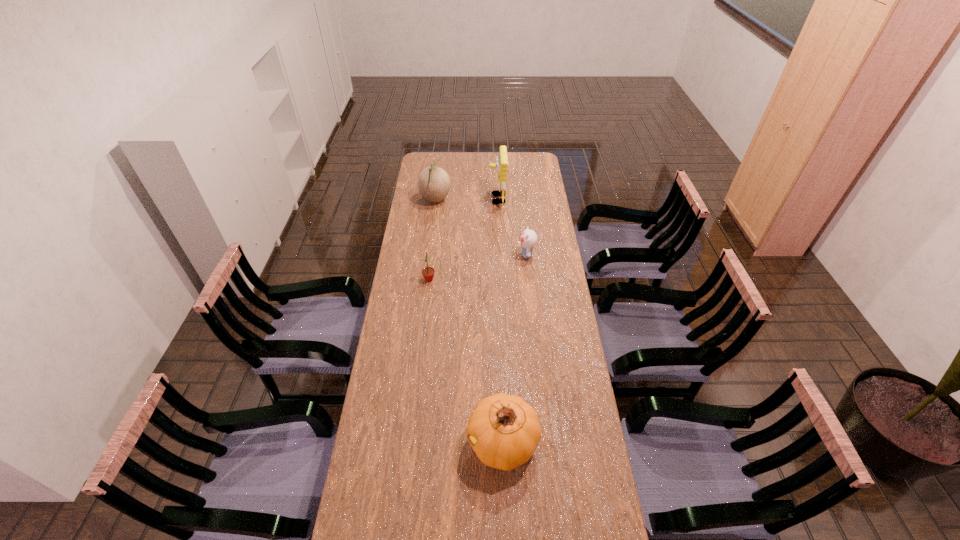
The width and height of the screenshot is (960, 540). What are the coordinates of `sponge` in the screenshot? It's located at (501, 165).

Where is `cantaloup`? The width and height of the screenshot is (960, 540). cantaloup is located at coordinates (433, 183).

You are a GUI agent. You are given a task and a screenshot of the screen. Output one action in this format:
    pyautogui.click(x=<x>, y=<y>)
    Task: Click on the pumpkin
    
    Given the screenshot: What is the action you would take?
    pyautogui.click(x=503, y=430)

At what (x,y) coordinates should I click in order to perform the action: click on sunflower. Please return your answer as a coordinate pair (x, y). The image size is (960, 540). Looking at the image, I should click on (428, 272).

Where is `the second nearest object`? The height and width of the screenshot is (540, 960). the second nearest object is located at coordinates (428, 272).

Where is `the shortest object`? the shortest object is located at coordinates (528, 238).

Identify the location of kitten. (528, 238).

Identify the location of vacant space located on the face of the sponge. (453, 199).

This screenshot has width=960, height=540. In order to click on blank space located 0.170m on the face of the sponge in this screenshot , I will do click(x=457, y=199).

Image resolution: width=960 pixels, height=540 pixels. I want to click on vacant region located 0.210m on the face of the sponge, so click(449, 199).